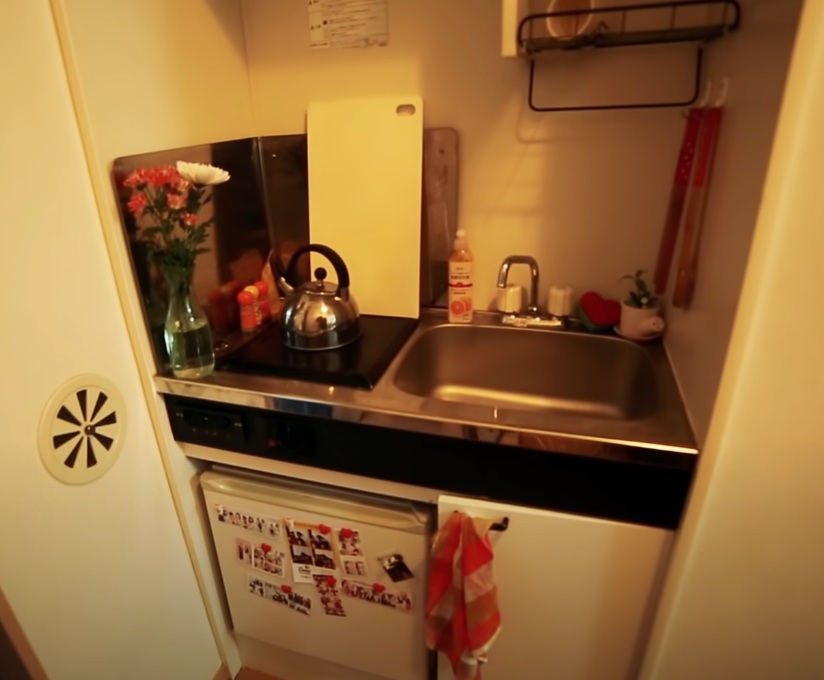
Image resolution: width=824 pixels, height=680 pixels. I want to click on sink, so click(530, 384).